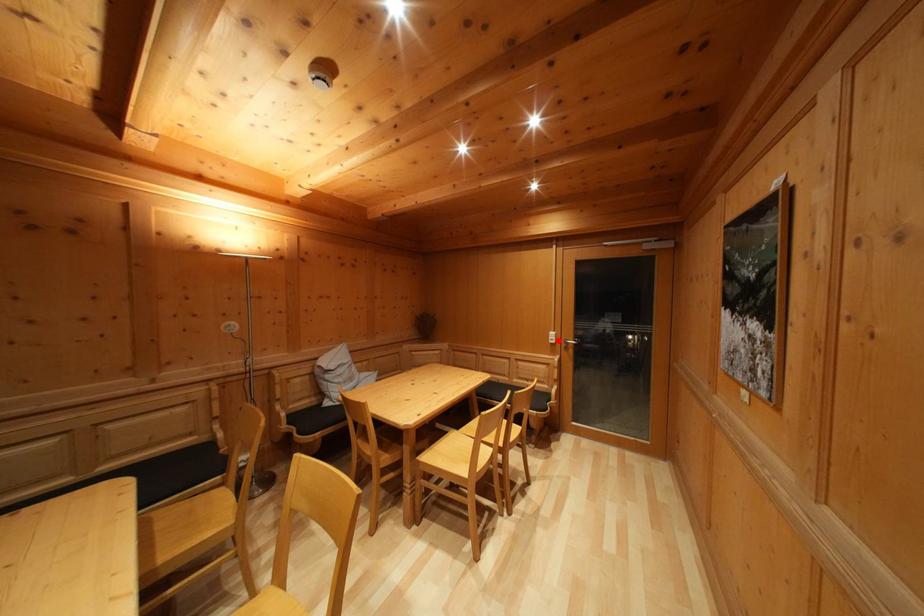
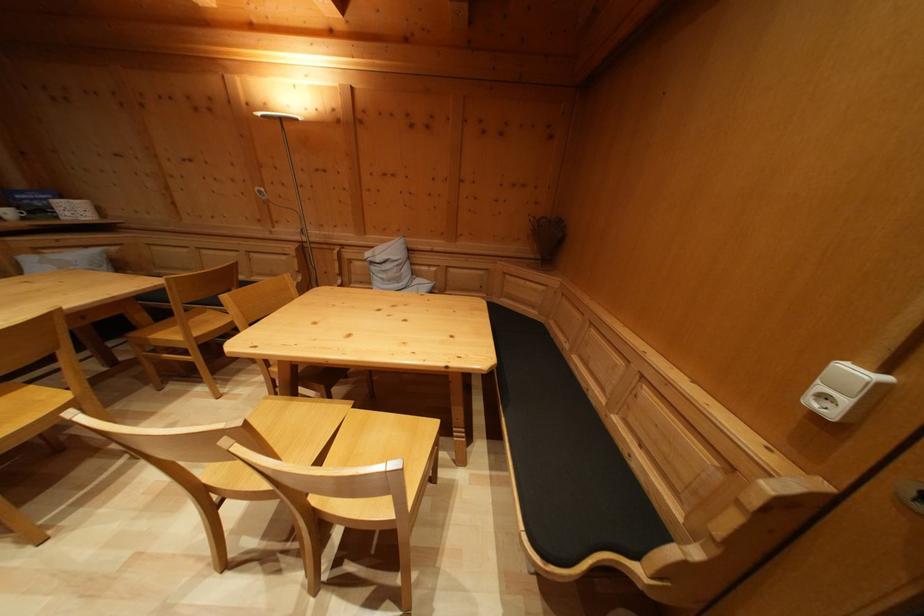
Question: I am providing you with two images of the same scene from different viewpoints. In image1, a red point is highlighted. Considering the same 3D point in image2, which of the following is correct?

Choices:
 (A) It is closer
 (B) It is farther

Answer: (B)